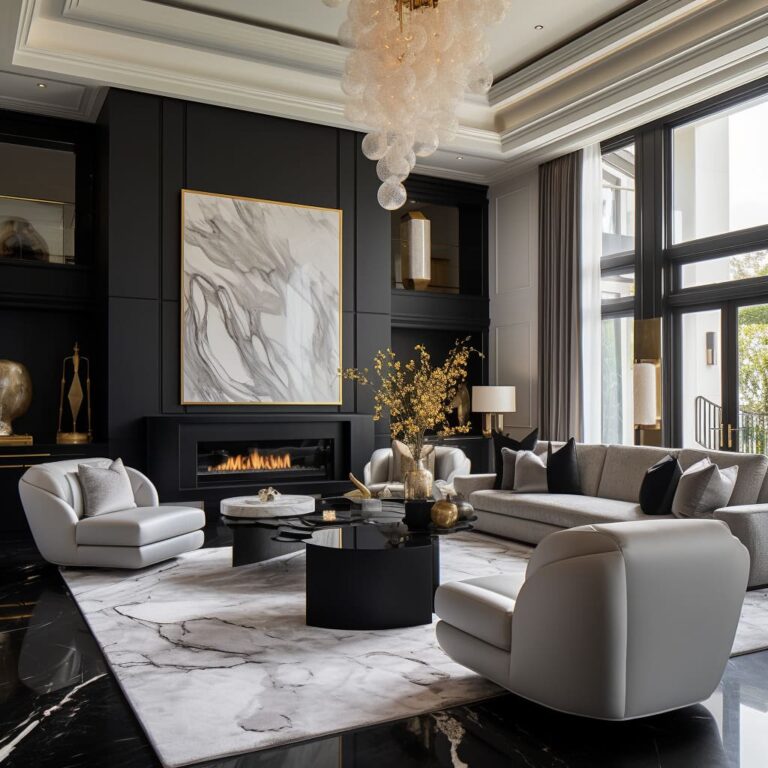
Locate an element on the screen. The image size is (768, 768). pillows is located at coordinates (501, 437), (507, 452), (525, 462), (555, 464), (660, 485), (677, 488).